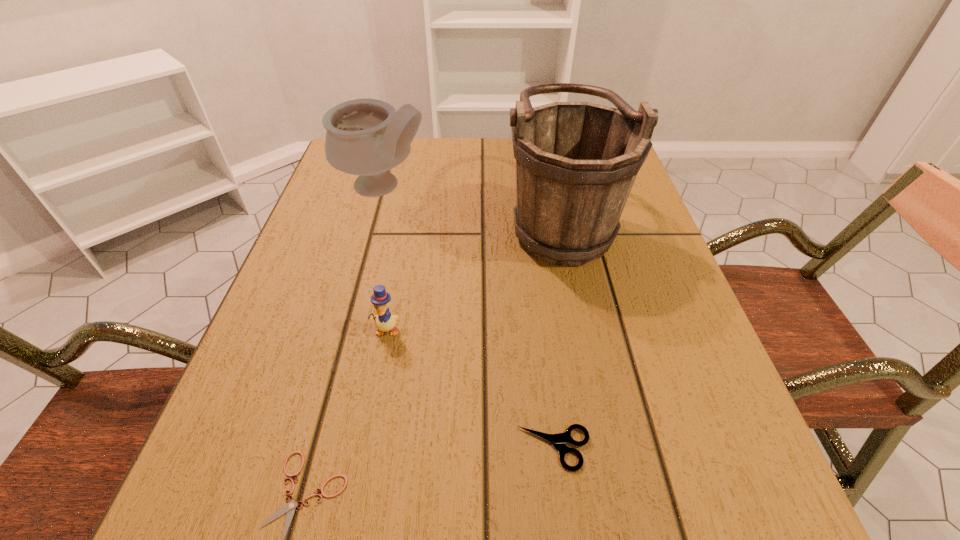
This screenshot has height=540, width=960. Find the location of `the tallest object`. the tallest object is located at coordinates (576, 162).

Identify the location of the fourth shortest object. This screenshot has width=960, height=540. (367, 137).

Identify the location of duckling. (385, 321).

Where is `the third tallest object`? This screenshot has width=960, height=540. the third tallest object is located at coordinates click(385, 321).

You are a GUI agent. You are given a task and a screenshot of the screen. Output one action in this format:
    pyautogui.click(x=<x>, y=<y>)
    Task: Click on the second shortest object
    This screenshot has width=960, height=540.
    Given the screenshot: What is the action you would take?
    pyautogui.click(x=558, y=440)

The image size is (960, 540). Find the location of `the taller shears`. the taller shears is located at coordinates (558, 440).

The height and width of the screenshot is (540, 960). In order to click on vacant space situated 0.290m on the handle side of the bucket in this screenshot , I will do `click(372, 218)`.

I want to click on free space located on the handle side of the bucket, so click(x=403, y=218).

At what (x,y) coordinates should I click in order to perform the action: click on blank area located 0.280m on the handle side of the bucket. Please return your answer as a coordinate pair (x, y). This screenshot has height=540, width=960. Looking at the image, I should click on (376, 218).

You are a GUI agent. You are given a task and a screenshot of the screen. Output one action in this format:
    pyautogui.click(x=<x>, y=<y>)
    Task: Click on the vacant space situated on the front of the fourth shortest object
    Image resolution: width=960 pixels, height=540 pixels.
    Given the screenshot: What is the action you would take?
    (x=372, y=228)